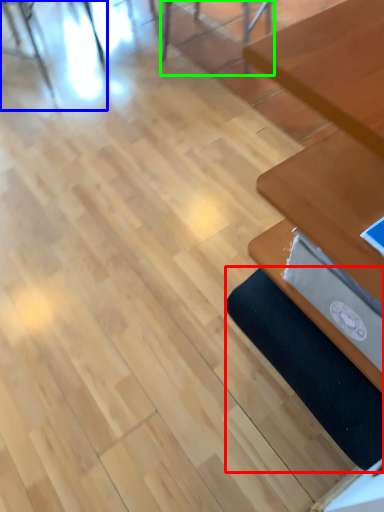
Question: Which object is the closest to the yoga mat (highlighted by a red box)? Choose among these: chair (highlighted by a blue box) or chair (highlighted by a green box).

Choices:
 (A) chair
 (B) chair

Answer: (B)